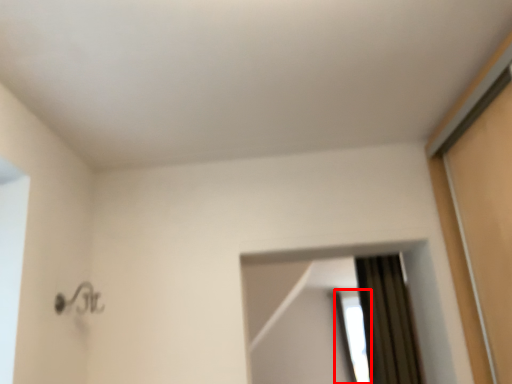
Question: From the image's perspective, where is window (annotated by the red box) located relative to mirror?

Choices:
 (A) above
 (B) below

Answer: (B)